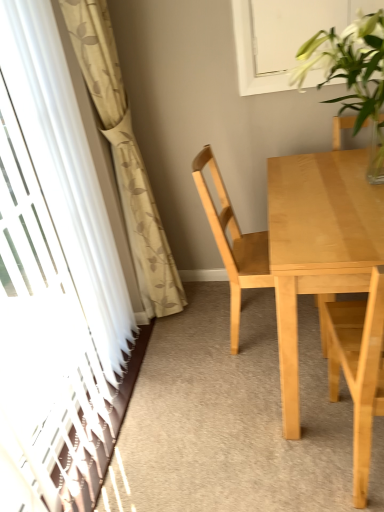
Where is `free region under beige floral curtain at left (from a real-world perspective)`? The width and height of the screenshot is (384, 512). free region under beige floral curtain at left (from a real-world perspective) is located at coordinates (169, 332).